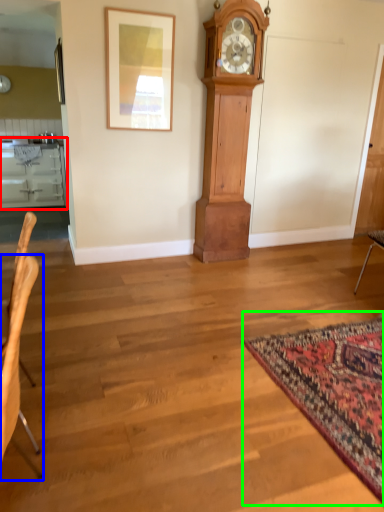
Question: Which object is the closest to the cabinetry (highlighted by a red box)? Choose among these: chair (highlighted by a blue box) or mat (highlighted by a green box).

Choices:
 (A) chair
 (B) mat

Answer: (A)